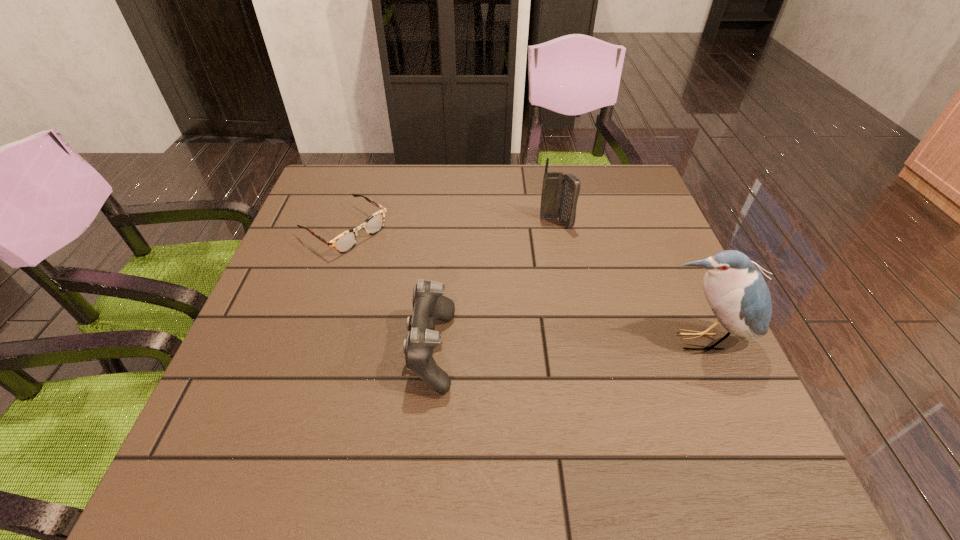
Identify the location of vacant area situated 0.180m on the surface of the second object from left to right with buttons. This screenshot has height=540, width=960. (317, 350).

I want to click on free space located 0.240m on the frame of the leftmost object, so click(444, 294).

The image size is (960, 540). Find the location of `vacant space located on the frame of the leftmost object`. vacant space located on the frame of the leftmost object is located at coordinates (387, 257).

Where is `vacant space located on the frame of the leftmost object`? The image size is (960, 540). vacant space located on the frame of the leftmost object is located at coordinates (404, 268).

You are a GUI agent. You are given a task and a screenshot of the screen. Output one action in this format:
    pyautogui.click(x=<x>, y=<y>)
    Task: Click on the vacant space located 0.050m on the keyboard of the cellular telephone
    This screenshot has height=540, width=960.
    Given the screenshot: What is the action you would take?
    pyautogui.click(x=560, y=242)

I want to click on vacant space located on the keyboard of the cellular telephone, so click(579, 339).

This screenshot has width=960, height=540. What are the coordinates of `vacant area situated on the keyboard of the cellular telephone` in the screenshot? It's located at (578, 335).

The height and width of the screenshot is (540, 960). Find the location of `object that is at the far edge`. object that is at the far edge is located at coordinates (346, 241).

Locate an element on the screen. object situated at the near edge is located at coordinates (429, 304).

This screenshot has height=540, width=960. What are the coordinates of `object at the left edge` in the screenshot? It's located at (346, 241).